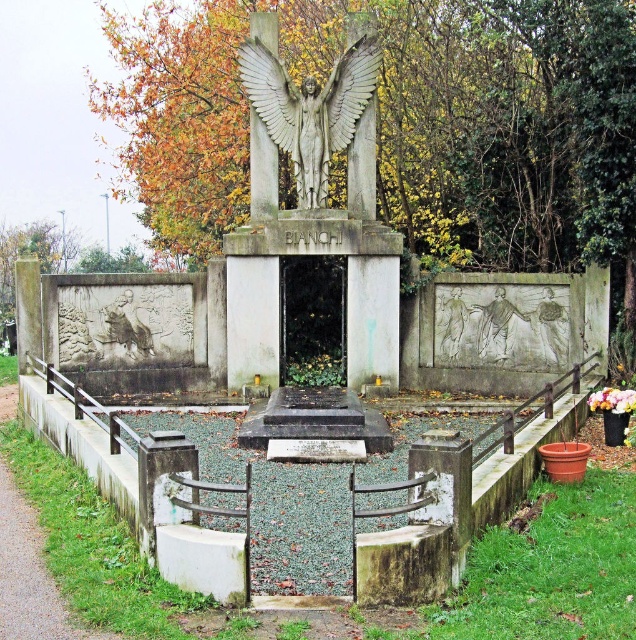
Question: Among these points, which one is farthest from the camera?

Choices:
 (A) (328, 147)
 (B) (266, 154)

Answer: (B)

Question: Does polished stone angel at center appear on the left side of bronze statue of an angel at center?

Choices:
 (A) no
 (B) yes

Answer: (A)

Question: Does polished stone angel at center appear over bronze statue of an angel at center?

Choices:
 (A) no
 (B) yes

Answer: (A)

Question: Which point is farther to the camera?

Choices:
 (A) polished stone angel at center
 (B) bronze statue of an angel at center

Answer: (B)

Question: Is polished stone angel at center positioned before bronze statue of an angel at center?

Choices:
 (A) no
 (B) yes

Answer: (B)

Question: Which point is closer to the camera taking this photo?

Choices:
 (A) (354, 385)
 (B) (322, 134)

Answer: (A)